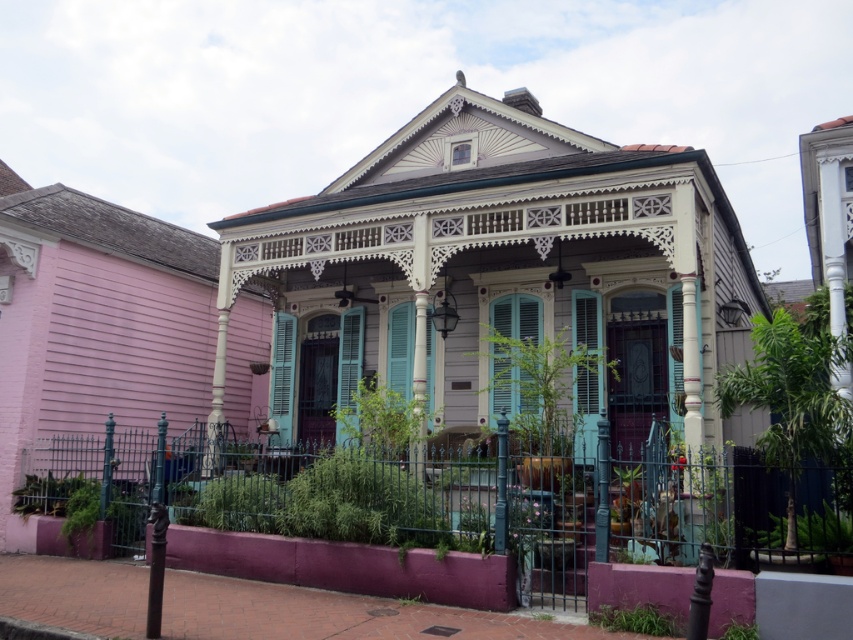
Question: Does teal matte shutter at center have a smaller size compared to matte teal shutter at center?

Choices:
 (A) yes
 (B) no

Answer: (B)

Question: Which point is farther to the camera?

Choices:
 (A) matte teal shutter at center
 (B) teal matte shutter at center

Answer: (A)

Question: Does teal matte shutter at center appear on the left side of matte teal shutter at center?

Choices:
 (A) no
 (B) yes

Answer: (B)

Question: Which point is closer to the camera?

Choices:
 (A) matte teal shutter at center
 (B) teal matte shutter at center

Answer: (B)

Question: Does teal matte shutter at center appear under matte teal shutter at center?

Choices:
 (A) no
 (B) yes

Answer: (B)